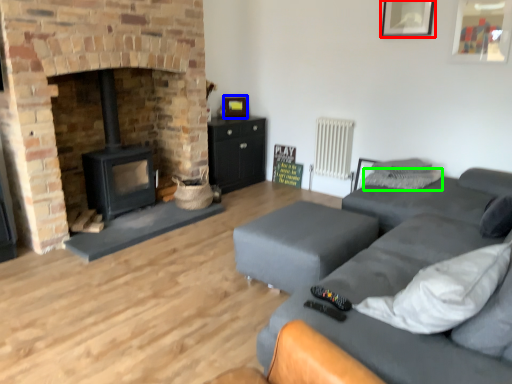
Question: Which is farther away from picture frame (highlighted by a red box)? picture frame (highlighted by a blue box) or pillow (highlighted by a green box)?

Choices:
 (A) picture frame
 (B) pillow

Answer: (A)